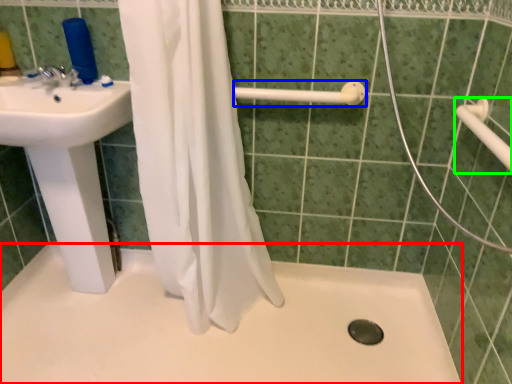
Question: Which object is the farthest from bath (highlighted by a red box)? Choose among these: shower (highlighted by a blue box) or towel bar (highlighted by a green box).

Choices:
 (A) shower
 (B) towel bar

Answer: (B)